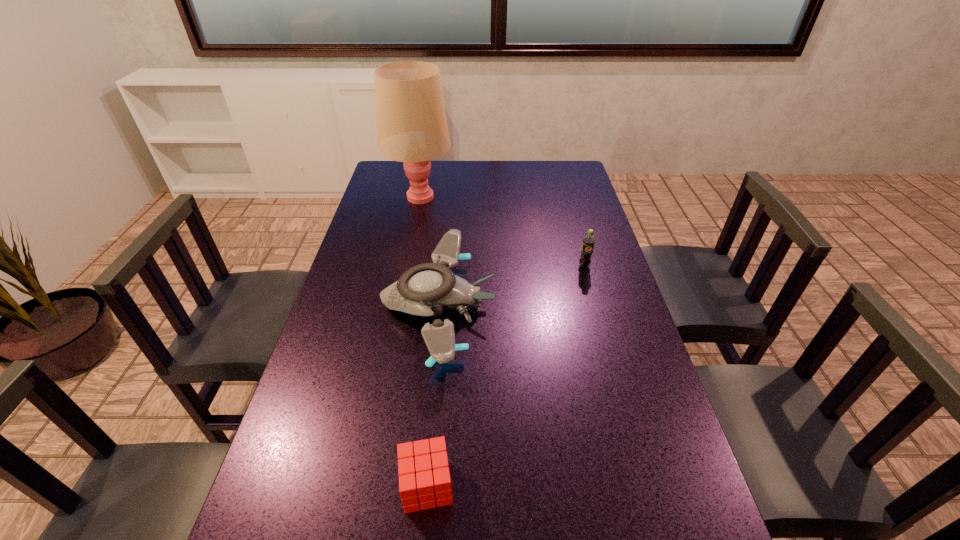
Find the location of a particular element. The width and height of the screenshot is (960, 540). lampshade is located at coordinates (412, 128).

Locate an element on the screen. The image size is (960, 540). the tallest object is located at coordinates tap(412, 128).

Where is `soda`? soda is located at coordinates (588, 241).

The height and width of the screenshot is (540, 960). I want to click on the third shortest object, so click(x=588, y=241).

The height and width of the screenshot is (540, 960). I want to click on drone, so click(427, 289).

The height and width of the screenshot is (540, 960). I want to click on cube, so click(421, 473).

The height and width of the screenshot is (540, 960). I want to click on the nearest object, so point(421,473).

Image resolution: width=960 pixels, height=540 pixels. In order to click on blank area located 0.080m on the back of the lampshade in this screenshot , I will do `click(424, 172)`.

In order to click on blank area located 0.070m on the front label of the soda in this screenshot , I will do `click(589, 285)`.

In order to click on free spot located 0.240m on the front-facing side of the drone in this screenshot , I will do point(578,306).